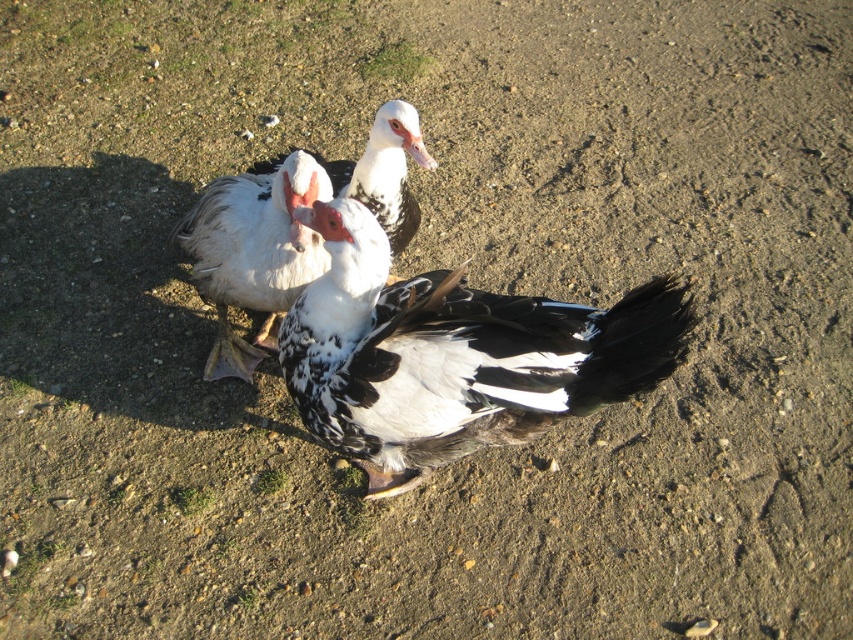
Identify the location of speckled feathered goose at center. This screenshot has width=853, height=640. (454, 355).

Does point (355, 301) come farther from viewer compared to point (260, 189)?

No.

I want to click on speckled feathered goose at center, so click(454, 355).